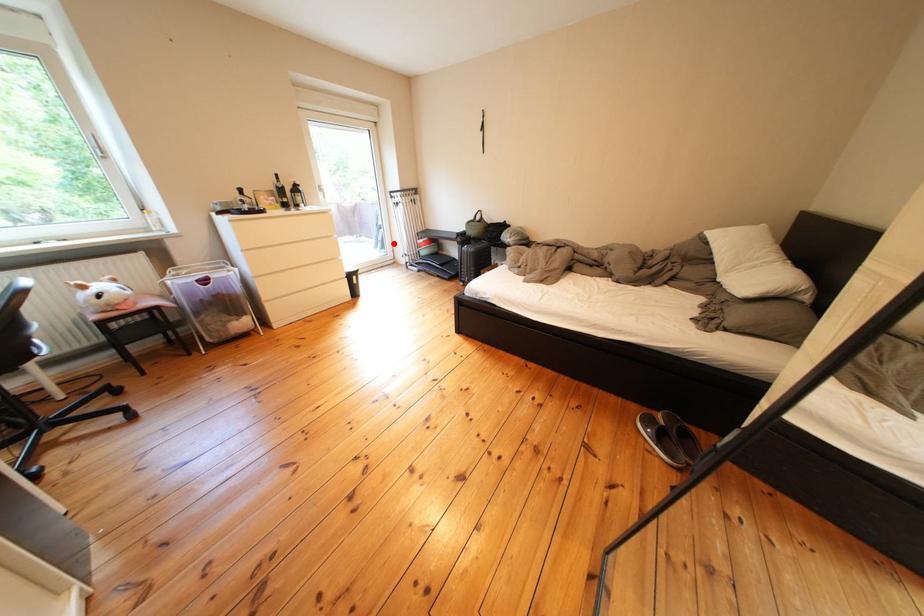
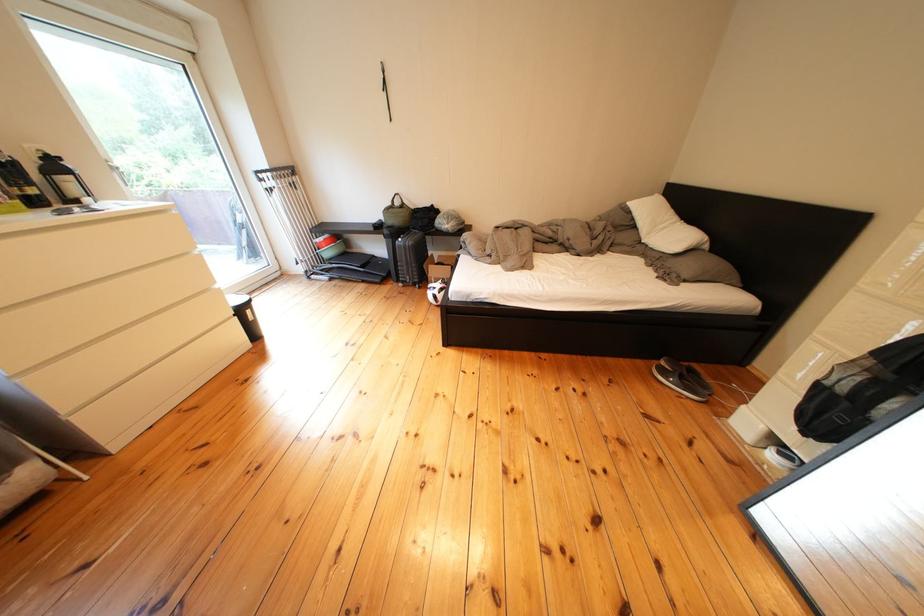
Where in the second image is the point corresponding to the highlighted location from the first image?

(259, 248)